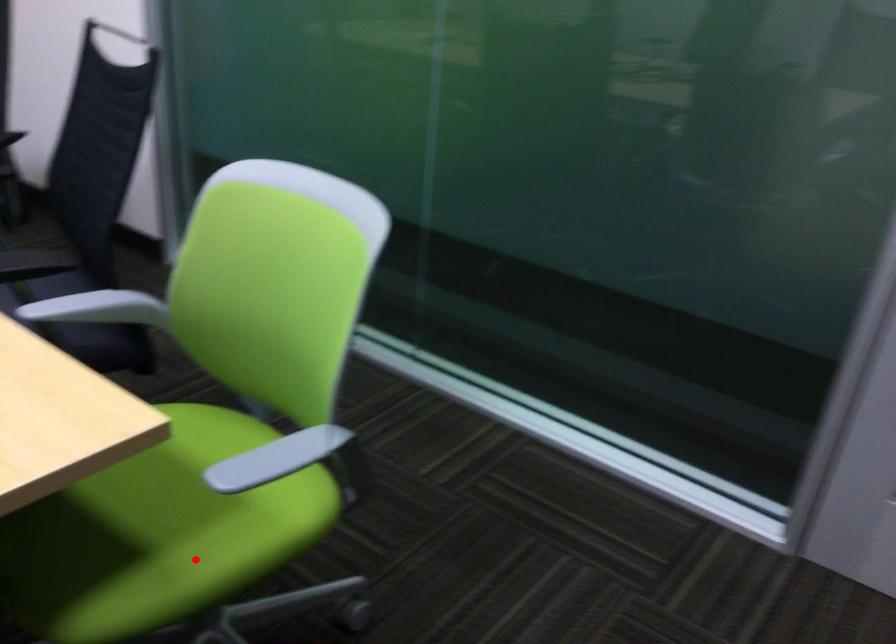
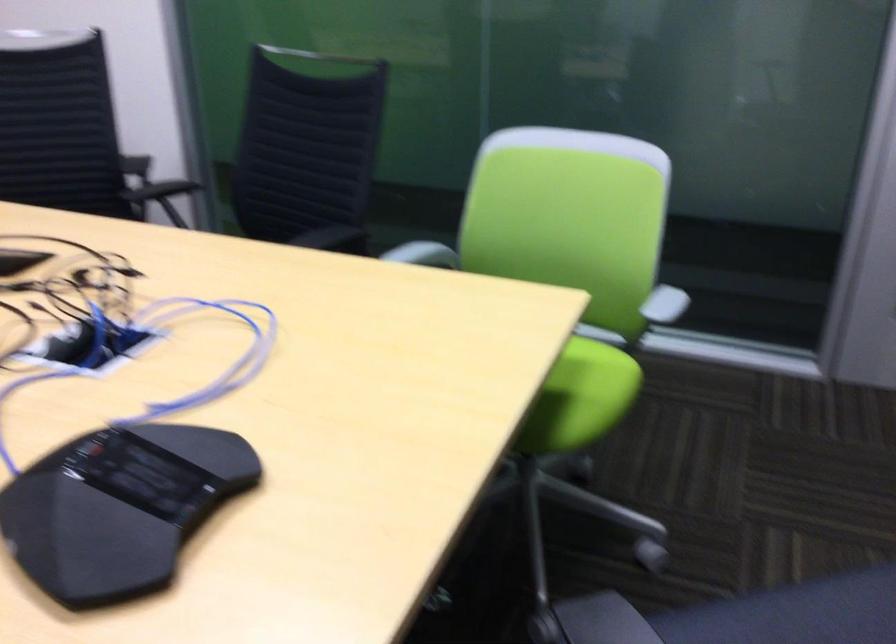
Question: I am providing you with two images of the same scene from different viewpoints. Image1 has a red point marked. In image2, the corresponding 3D location appears at what relative position? Reply with the corresponding letter.

Choices:
 (A) Closer
 (B) Farther

Answer: (B)